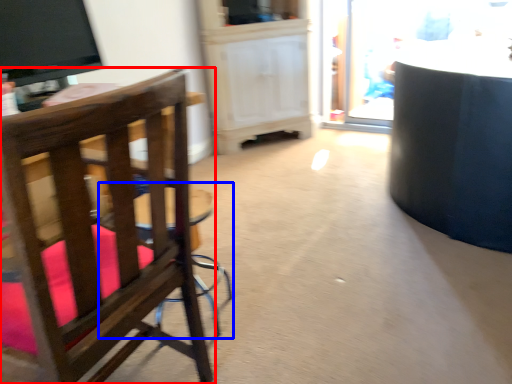
Question: Which object appears closest to the camera in this image, chair (highlighted by a red box) or bar stool (highlighted by a blue box)?

Choices:
 (A) chair
 (B) bar stool

Answer: (A)